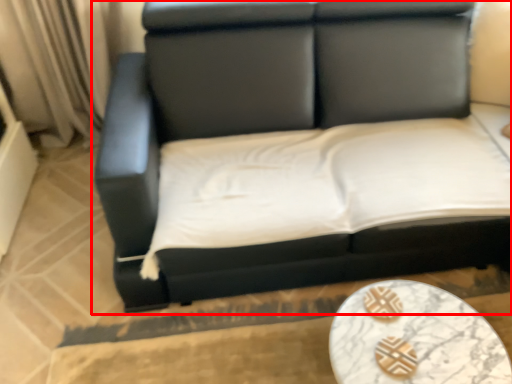
Question: From the image, what is the correct spatial relationship of studio couch (annotated by the red box) in relation to table?

Choices:
 (A) left
 (B) right

Answer: (A)